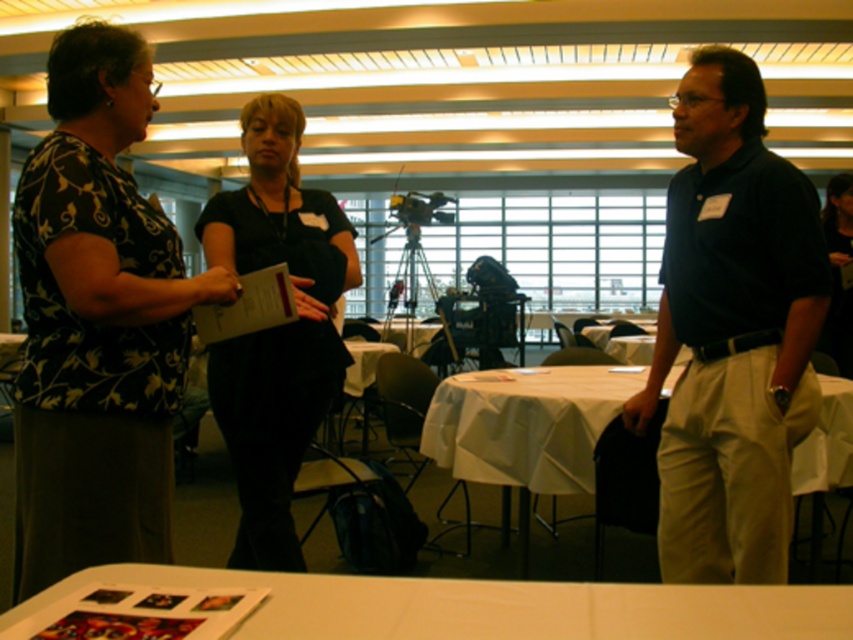
Question: Can you confirm if dark blue shirt at center is positioned below white cloth table at center?

Choices:
 (A) no
 (B) yes

Answer: (A)

Question: Which is nearer to the white matte table at lower center?

Choices:
 (A) black floral blouse at left
 (B) dark blue shirt at center
 (C) white cloth table at center
 (D) black matte shirt at center

Answer: (A)

Question: Does black floral blouse at left lie behind white cloth table at center?

Choices:
 (A) yes
 (B) no

Answer: (B)

Question: Where is black floral blouse at left located in relation to black matte shirt at center in the image?

Choices:
 (A) right
 (B) left

Answer: (B)

Question: Among these objects, which one is nearest to the camera?

Choices:
 (A) black floral blouse at left
 (B) white cloth table at center
 (C) black matte shirt at center
 (D) white matte table at lower center

Answer: (D)

Question: Which point is farther to the camera?

Choices:
 (A) white matte table at lower center
 (B) dark blue shirt at center

Answer: (B)